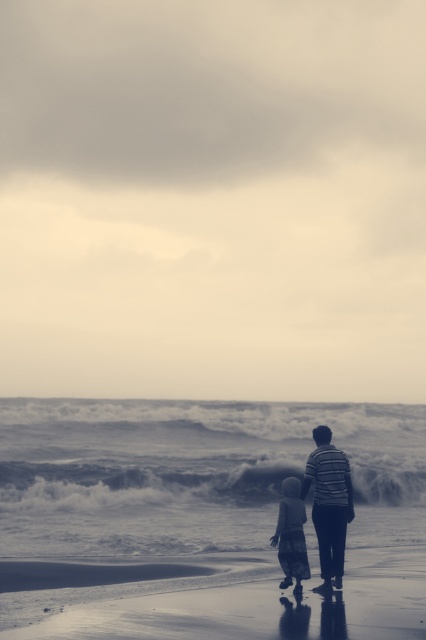
Question: Does smooth sand at lower center have a lesser width compared to light gray cotton dress at lower center?

Choices:
 (A) no
 (B) yes

Answer: (A)

Question: Can you confirm if smooth sand at lower center is positioned above light gray cotton dress at lower center?

Choices:
 (A) no
 (B) yes

Answer: (A)

Question: Considering the real-world distances, which object is farthest from the striped fabric at center?

Choices:
 (A) smooth sand at lower center
 (B) light gray cotton dress at lower center

Answer: (A)

Question: Can you confirm if smooth sand at lower center is smaller than light gray cotton dress at lower center?

Choices:
 (A) no
 (B) yes

Answer: (A)

Question: Which point is closer to the camera taking this photo?

Choices:
 (A) (412, 580)
 (B) (294, 586)

Answer: (B)

Question: Which is farther from the striped fabric at center?

Choices:
 (A) light gray cotton dress at lower center
 (B) smooth sand at lower center

Answer: (B)